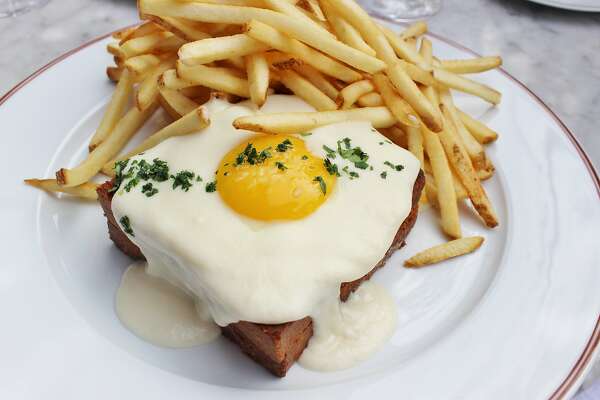
Identify the location of rim of white plate. The image size is (600, 400). click(60, 370), click(71, 84).